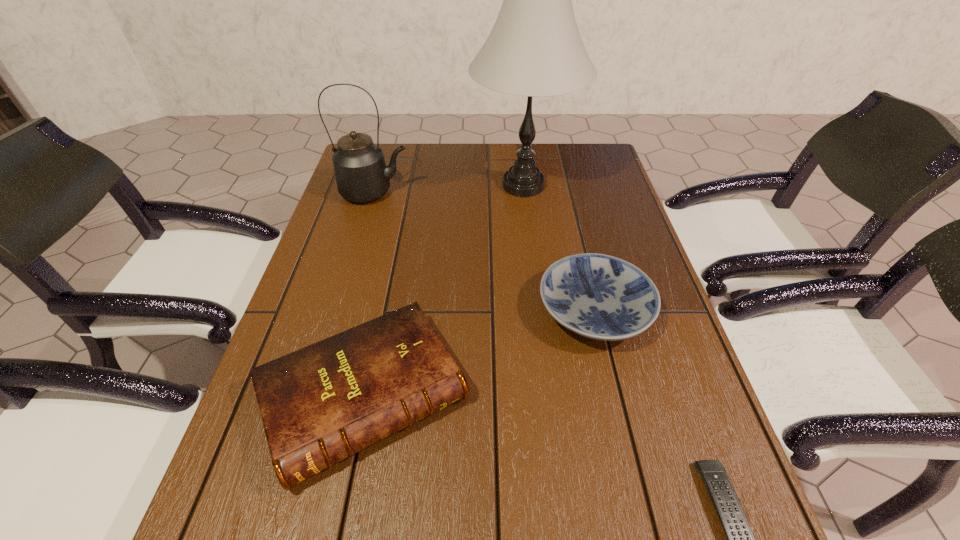
Where is `kettle located in the left edge section of the desktop`? Image resolution: width=960 pixels, height=540 pixels. kettle located in the left edge section of the desktop is located at coordinates (361, 173).

You are a GUI agent. You are given a task and a screenshot of the screen. Output one action in this format:
    pyautogui.click(x=<x>, y=<y>)
    Task: Click on the hardback book that is at the left edge
    This screenshot has height=540, width=960.
    Given the screenshot: What is the action you would take?
    pyautogui.click(x=325, y=402)

Locate an element on the screen. The image size is (960, 540). lamp that is at the right edge is located at coordinates (534, 49).

Where is `plate at the right edge`? plate at the right edge is located at coordinates (598, 296).

Where is `object situated at the far left corner`? object situated at the far left corner is located at coordinates (361, 173).

At what (x,y) coordinates should I click in order to perform the action: click on object that is positioned at the far right corner. Please return your answer as a coordinate pair (x, y). Looking at the image, I should click on (534, 49).

You are a GUI agent. You are given a task and a screenshot of the screen. Output one action in this format:
    pyautogui.click(x=<x>, y=<y>)
    Task: Click on the vacant area at the far edge of the desktop
    This screenshot has height=540, width=960.
    Given the screenshot: What is the action you would take?
    pyautogui.click(x=424, y=152)

What are the coordinates of `vacant space at the left edge of the desktop` in the screenshot? It's located at (359, 205).

I want to click on vacant space at the right edge of the desktop, so click(717, 444).

Identify the location of vacant space at the far left corner. tap(397, 144).